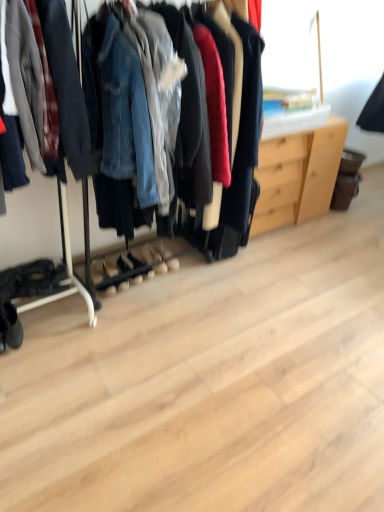
Question: Would you say light wood dresser at center is part of black suede boot at lower left's contents?

Choices:
 (A) no
 (B) yes

Answer: (A)

Question: Is there a large distance between black suede boot at lower left and light wood dresser at center?

Choices:
 (A) no
 (B) yes

Answer: (B)

Question: From the image's perspective, is black suede boot at lower left on light wood dresser at center?

Choices:
 (A) no
 (B) yes

Answer: (A)

Question: Is light wood dresser at center at the back of black suede boot at lower left?

Choices:
 (A) yes
 (B) no

Answer: (B)

Question: Considering the relative sizes of black suede boot at lower left and light wood dresser at center in the image provided, is black suede boot at lower left bigger than light wood dresser at center?

Choices:
 (A) yes
 (B) no

Answer: (B)

Question: Considering the relative sizes of black suede boot at lower left and light wood dresser at center in the image provided, is black suede boot at lower left wider than light wood dresser at center?

Choices:
 (A) no
 (B) yes

Answer: (A)

Question: Is the position of light wood dresser at center more distant than that of black suede boot at lower left?

Choices:
 (A) yes
 (B) no

Answer: (A)

Question: From the image's perspective, would you say light wood dresser at center is positioned over black suede boot at lower left?

Choices:
 (A) yes
 (B) no

Answer: (A)

Question: Is light wood dresser at center facing towards black suede boot at lower left?

Choices:
 (A) yes
 (B) no

Answer: (B)

Question: Is light wood dresser at center outside black suede boot at lower left?

Choices:
 (A) no
 (B) yes

Answer: (B)

Question: Can you confirm if light wood dresser at center is positioned to the left of black suede boot at lower left?

Choices:
 (A) yes
 (B) no

Answer: (B)

Question: Is light wood dresser at center taller than black suede boot at lower left?

Choices:
 (A) yes
 (B) no

Answer: (A)

Question: Is point (11, 308) closer or farther from the camera than point (306, 198)?

Choices:
 (A) closer
 (B) farther

Answer: (A)